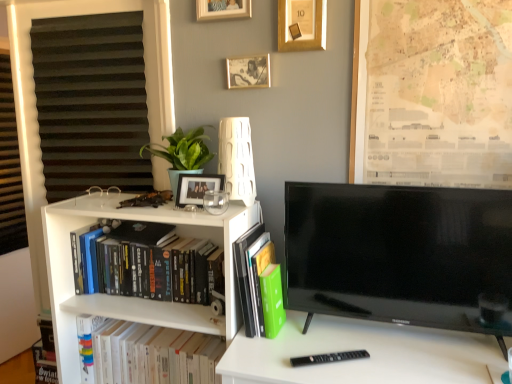
Question: Considering their positions, is matte black picture frame at upper center, which ranks as the fourth picture frame in top-to-bottom order, located in front of or behind black glossy tv at right?

Choices:
 (A) front
 (B) behind

Answer: (B)

Question: From the image's perspective, is matte black picture frame at upper center, which ranks as the fourth picture frame in top-to-bottom order, above or below black glossy tv at right?

Choices:
 (A) below
 (B) above

Answer: (B)

Question: Based on their relative distances, which object is nearer to the matte black picture frame at upper center, which ranks as the fourth picture frame in top-to-bottom order?

Choices:
 (A) black glossy tv at right
 (B) hardcover books at left, the first book when ordered from top to bottom
 (C) gold metallic picture frame at upper center, placed as the third picture frame when sorted from bottom to top
 (D) white paper book at lower left, which is the first book in bottom-to-top order
 (E) white matte desk at center

Answer: (B)

Question: Estimate the real-world distances between objects in this image. Which object is closer to the beige paper map at upper right?

Choices:
 (A) hardcover books at left, which is the third book from bottom to top
 (B) white matte lamp at upper center
 (C) green matte plant at upper left
 (D) wooden photo frame at upper center, placed as the third picture frame when sorted from top to bottom
 (E) matte black picture frame at upper center, the first picture frame when ordered from bottom to top

Answer: (D)